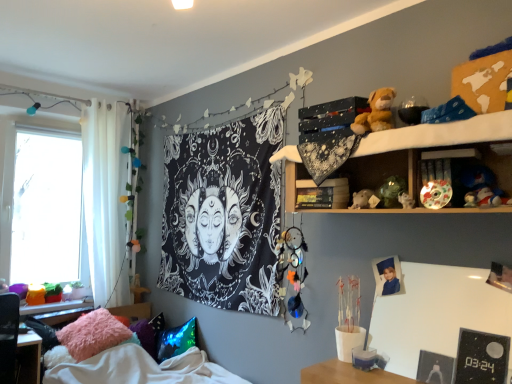
Question: Considering the positions of point coord(436,188) and point coord(287,248), is point coord(436,188) closer or farther from the camera than point coord(287,248)?

Choices:
 (A) farther
 (B) closer

Answer: (B)

Question: Considering their positions, is shiny multicolored ball at upper right, which is the 4th toy from bottom to top, located in front of or behind multicolored dreamcatcher at center, the 6th toy when ordered from top to bottom?

Choices:
 (A) behind
 (B) front

Answer: (B)

Question: Which object is the closest to the brown plush toy at upper right, the 3th toy from the left?

Choices:
 (A) white sheer curtain at left
 (B) matte white teddy bear at center-right, which is counted as the second toy, starting from the left
 (C) wooden shelf at upper right
 (D) fluffy pink pillow at lower left, which is counted as the 3th pillow, starting from the right
 (E) black fabric tapestry at center

Answer: (C)

Question: Estimate the real-world distances between objects in this image. Which object is farther from the brown plush toy at upper right, the 3th toy from the left?

Choices:
 (A) fluffy pink pillow at lower left, which is counted as the 1th pillow, starting from the left
 (B) shiny blue pillow at lower left, acting as the 1th pillow starting from the right
 (C) matte white teddy bear at center-right, which is counted as the second toy, starting from the left
 (D) fuzzy fabric pillow at lower left, marked as the 2th pillow in a right-to-left arrangement
 (E) multicolored dreamcatcher at center, which is counted as the sixth toy, starting from the right

Answer: (D)